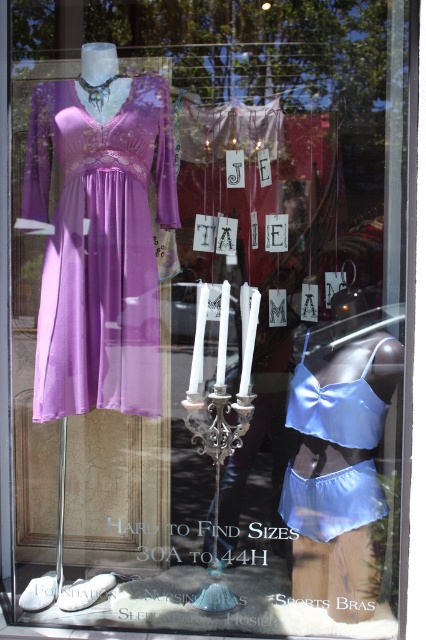
You are standing in front of the store window and notice two points marked in the display. Which of these points, point 1 at coordinates point (x=154, y=355) or point 2 at coordinates point (x=293, y=374), is closer to you?

Point 1 at coordinates point (x=154, y=355) is closer to you because it is closer to the camera than point 2 at coordinates point (x=293, y=374).

You are a store employee who needs to place a 24 inch wide decorative box between the matte purple dress at left and the satin blue lingerie at center. Can the box fit between them without overlapping either item?

The distance between the matte purple dress at left and the satin blue lingerie at center is 24.28 inches. Since the box is 24 inches wide, there is enough space to place it between them without overlapping either item.